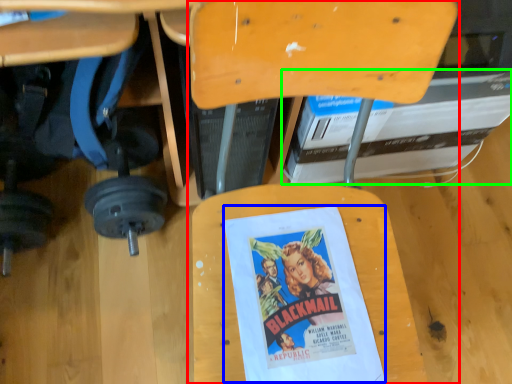
Question: Which is farther away from chair (highlighted by a red box)? movie poster (highlighted by a blue box) or paperback book (highlighted by a green box)?

Choices:
 (A) movie poster
 (B) paperback book

Answer: (B)